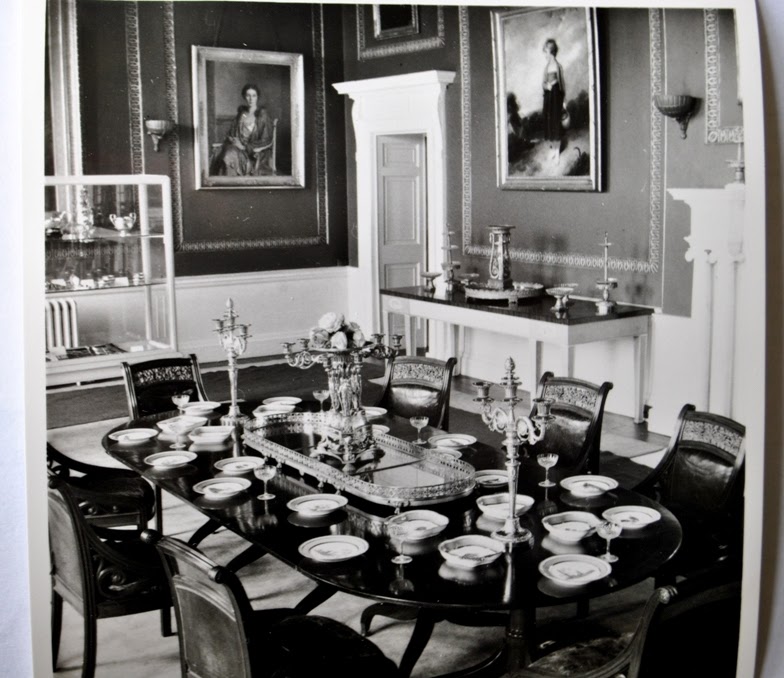
This screenshot has width=784, height=678. I want to click on chairs, so click(x=683, y=441), click(x=579, y=401), click(x=416, y=378), click(x=150, y=378), click(x=66, y=475), click(x=98, y=548), click(x=226, y=635), click(x=651, y=626).